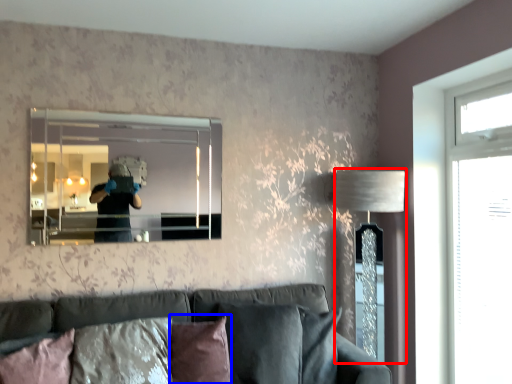
Question: Which of the following is the closest to the observer, table lamp (highlighted by a red box) or pillow (highlighted by a blue box)?

Choices:
 (A) table lamp
 (B) pillow

Answer: (B)